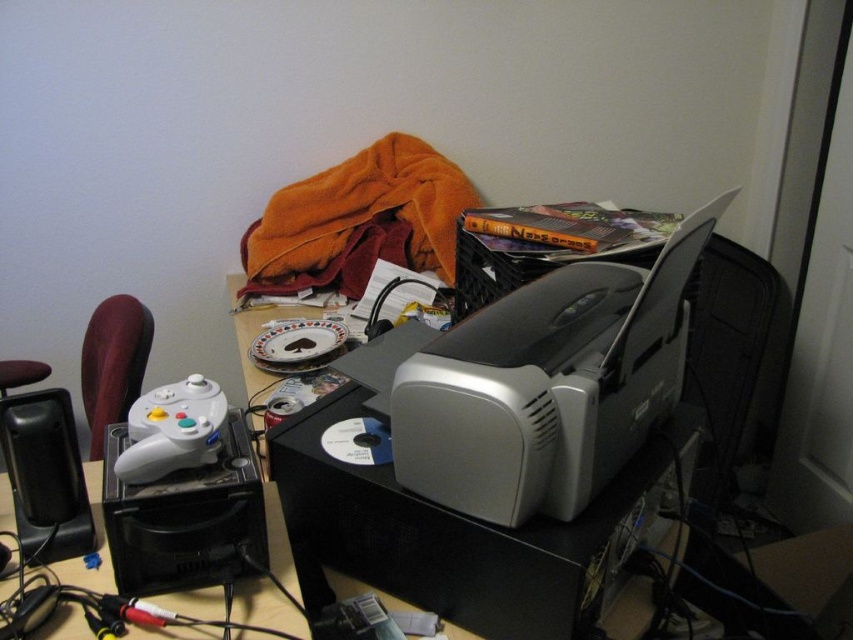
Measure the distance between silver plastic printer at center and black plastic speaker at lower left.

They are 20.63 inches apart.

Between point (723, 193) and point (86, 531), which one is positioned in front?

Point (723, 193)

This screenshot has height=640, width=853. What do you see at coordinates (547, 385) in the screenshot?
I see `silver plastic printer at center` at bounding box center [547, 385].

Where is `silver plastic printer at center`? This screenshot has width=853, height=640. silver plastic printer at center is located at coordinates (547, 385).

Who is taller, silver plastic printer at center or white matte game controller at lower left?

Standing taller between the two is silver plastic printer at center.

Does silver plastic printer at center have a larger size compared to white matte game controller at lower left?

Correct, silver plastic printer at center is larger in size than white matte game controller at lower left.

Between point (543, 428) and point (151, 472), which one is positioned in front?

Point (543, 428) is more forward.

Find the location of a particular element. This screenshot has height=640, width=853. silver plastic printer at center is located at coordinates tap(547, 385).

Which is in front, point (45, 506) or point (190, 444)?

Point (190, 444) is in front.

Is black plastic speaker at lower left thinner than white matte game controller at lower left?

Incorrect, black plastic speaker at lower left's width is not less than white matte game controller at lower left's.

Between point (91, 522) and point (189, 465), which one is positioned behind?

Positioned behind is point (91, 522).

I want to click on black plastic speaker at lower left, so click(x=45, y=476).